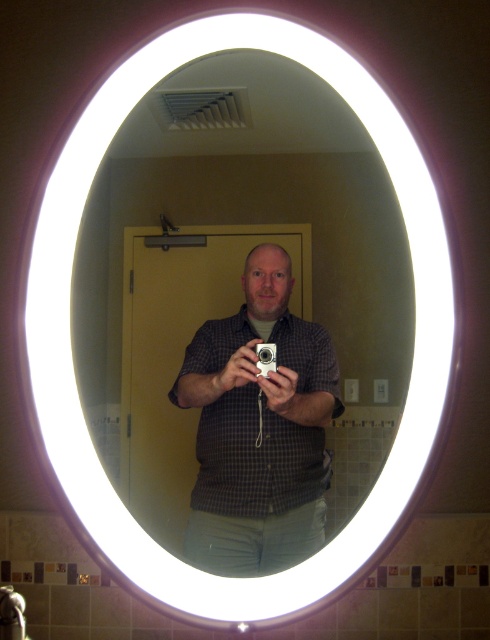
Is checkered shirt at center in front of silver metallic camera at center?

Yes, it is.

Is checkered shirt at center wider than silver metallic camera at center?

Correct, the width of checkered shirt at center exceeds that of silver metallic camera at center.

Which is in front, point (250, 289) or point (265, 376)?

Point (265, 376) is more forward.

Find the location of a particular element. checkered shirt at center is located at coordinates (258, 429).